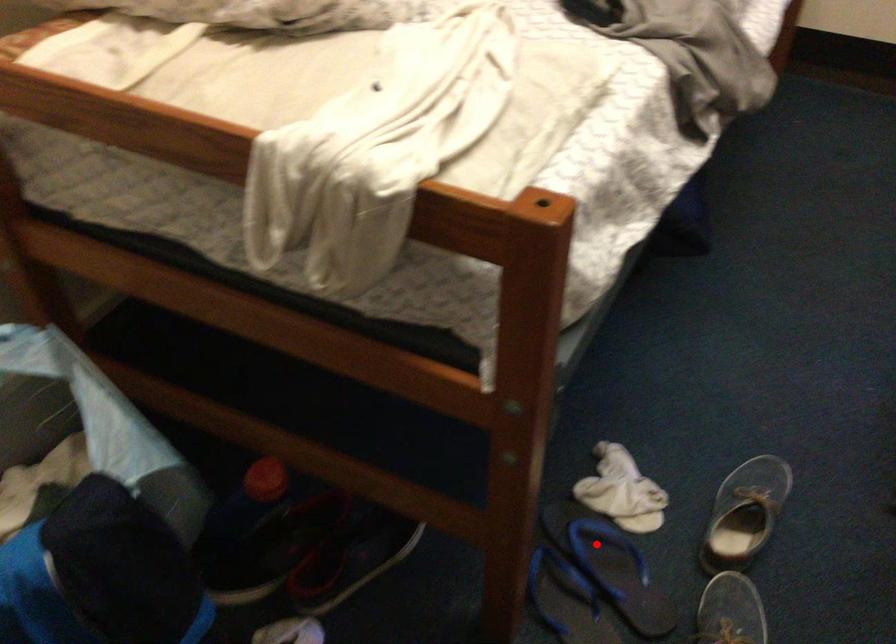
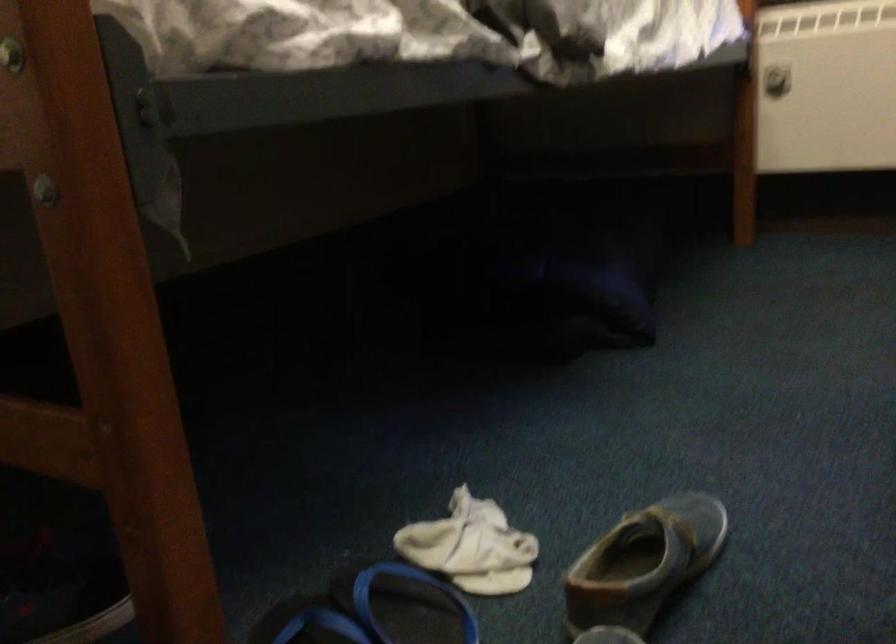
The point at the highlighted location is marked in the first image. Where is the corresponding point in the second image?

(406, 605)